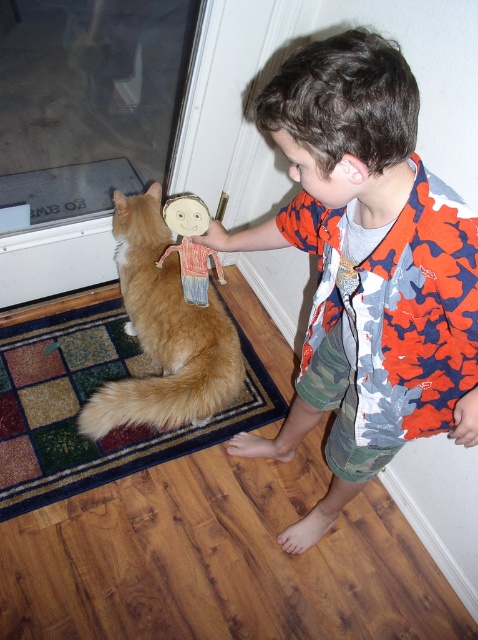
Question: Can you confirm if transparent glass door at upper left is wider than multicolored carpet at lower left?

Choices:
 (A) yes
 (B) no

Answer: (B)

Question: Is the position of camo-patterned shirt at center less distant than that of transparent glass door at upper left?

Choices:
 (A) no
 (B) yes

Answer: (B)

Question: Which object appears closest to the camera in this image?

Choices:
 (A) hand-drawn wooden doll at upper center
 (B) golden fur cat at left

Answer: (B)

Question: Does multicolored carpet at lower left have a greater width compared to hand-drawn wooden doll at upper center?

Choices:
 (A) yes
 (B) no

Answer: (A)

Question: Which object is the closest to the transparent glass door at upper left?

Choices:
 (A) camo-patterned shirt at center
 (B) hand-drawn wooden doll at upper center
 (C) multicolored carpet at lower left
 (D) golden fur cat at left

Answer: (D)

Question: Which point is closer to the camera?

Choices:
 (A) (165, 252)
 (B) (97, 483)
 (C) (88, 275)

Answer: (A)